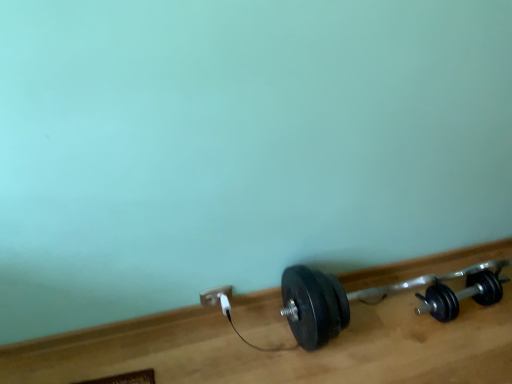
The height and width of the screenshot is (384, 512). Identify the location of free space underneath black rubber dumbbell at lower right, which is counted as the 2th dumbbell, starting from the right (from a real-world perspective). (385, 310).